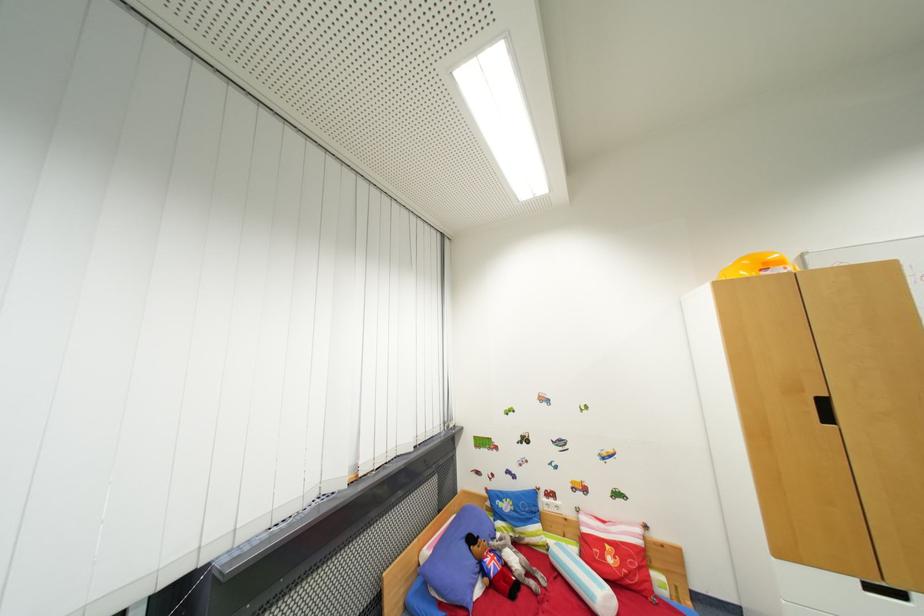
Find where to pull the black cabinet handle. Please return your answer as a coordinate pair (x, y).

(824, 410)